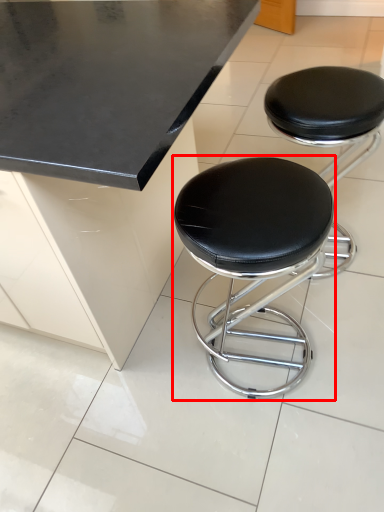
Question: From the image, what is the correct spatial relationship of stool (annotated by the red box) in relation to stool?

Choices:
 (A) right
 (B) left

Answer: (B)